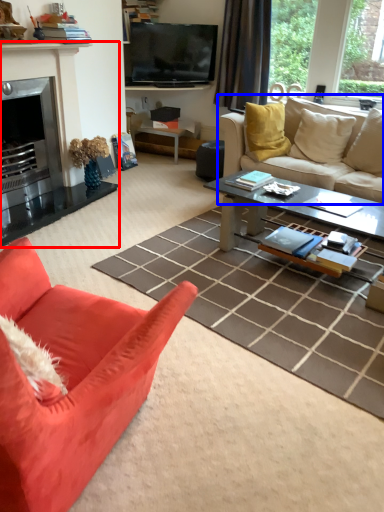
Question: Which object is closer to the camera taking this photo, fireplace (highlighted by a red box) or studio couch (highlighted by a blue box)?

Choices:
 (A) fireplace
 (B) studio couch

Answer: (A)